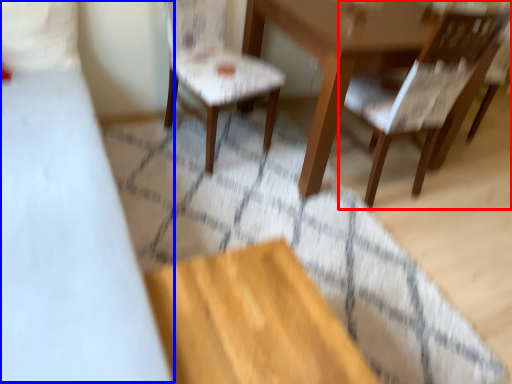
Question: Which of the following is the farthest to the observer, chair (highlighted by a red box) or bed (highlighted by a blue box)?

Choices:
 (A) chair
 (B) bed

Answer: (A)